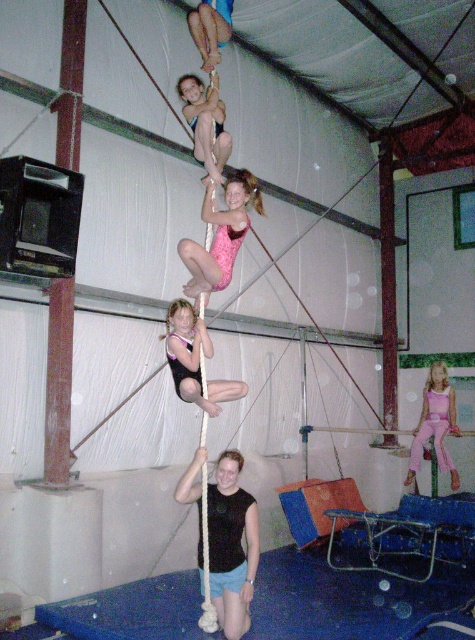
Question: Which object is positioned closest to the pink leotard at center?

Choices:
 (A) matte black leotard at center
 (B) pink fabric pole at center
 (C) white fabric pole at upper center

Answer: (A)

Question: Can you confirm if matte black leotard at center is positioned above pink fabric pole at center?

Choices:
 (A) no
 (B) yes

Answer: (B)

Question: Which point is closer to the camera taking this photo?

Choices:
 (A) click(178, 376)
 (B) click(226, 236)
 (C) click(445, 416)

Answer: (A)

Question: Estimate the real-world distances between objects in this image. Which object is closer to the matte black leotard at center?

Choices:
 (A) pink leotard at center
 (B) white fabric pole at upper center

Answer: (A)

Question: Does pink leotard at center appear on the right side of matte black leotard at center?

Choices:
 (A) no
 (B) yes

Answer: (B)

Question: Can you confirm if matte black leotard at center is positioned below pink fabric pole at center?

Choices:
 (A) yes
 (B) no

Answer: (B)